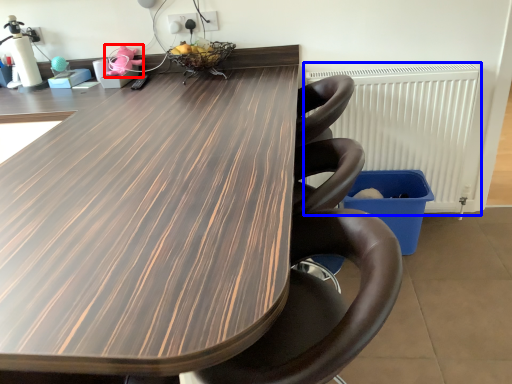
Question: Which object is further to the camera taking this photo, toy (highlighted by a red box) or radiator (highlighted by a blue box)?

Choices:
 (A) toy
 (B) radiator

Answer: (A)